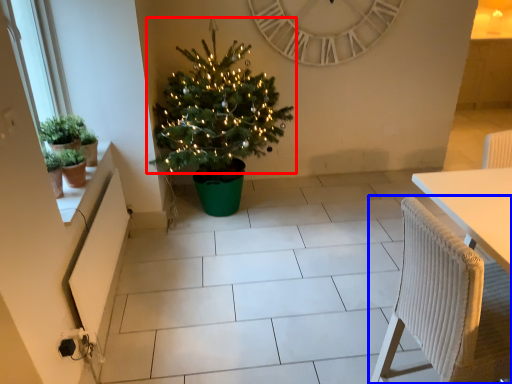
Question: Which object is closer to the camera taking this photo, christmas tree (highlighted by a red box) or chair (highlighted by a blue box)?

Choices:
 (A) christmas tree
 (B) chair

Answer: (B)